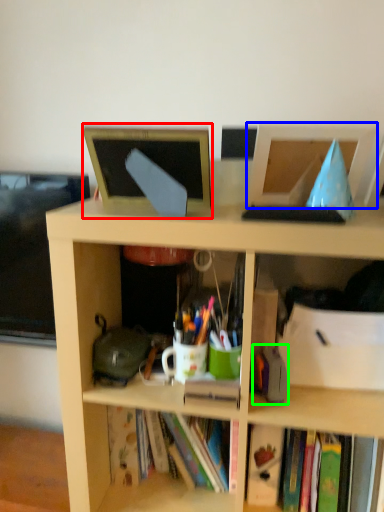
Question: Estimate the real-world distances between objects in this image. Which object is closer to computer monitor (highlighted by a red box), computer monitor (highlighted by a blue box) or stationery (highlighted by a green box)?

Choices:
 (A) computer monitor
 (B) stationery

Answer: (A)